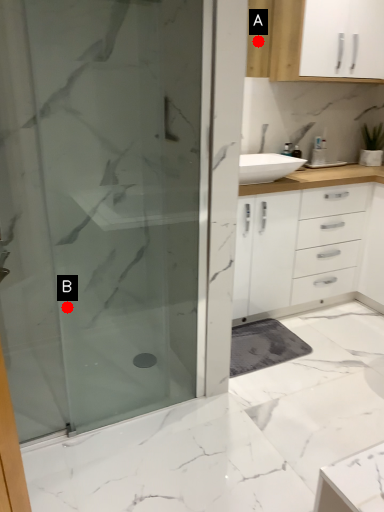
Question: Two points are circled on the image, labeled by A and B beside each circle. Which point is closer to the camera?

Choices:
 (A) A is closer
 (B) B is closer

Answer: (B)